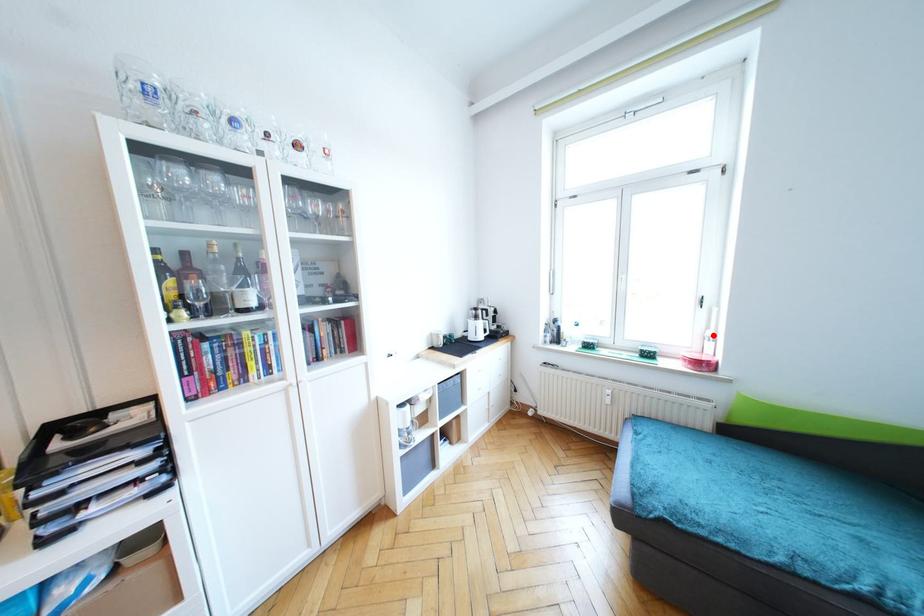
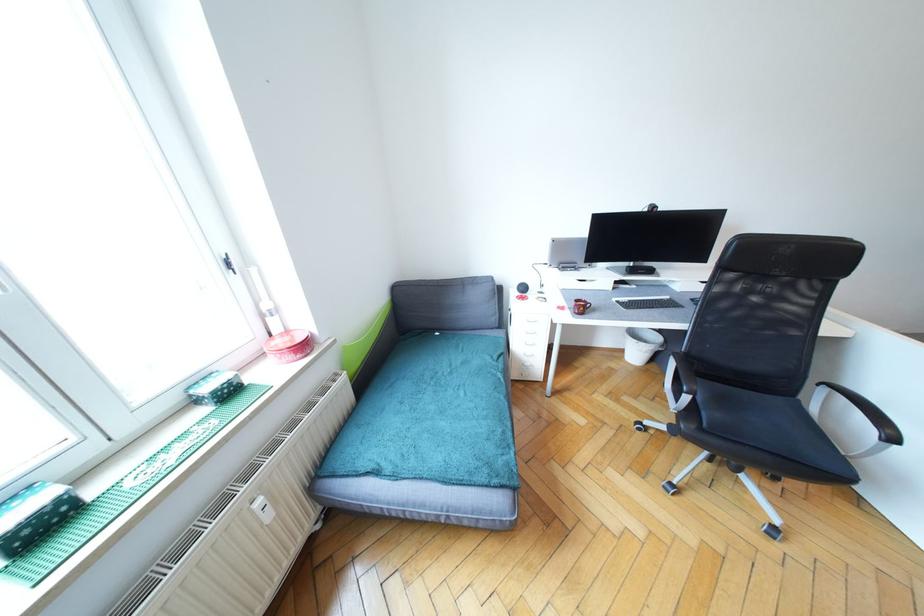
Locate, in the second image, the point that corresponds to the highlighted location in the first image.

(270, 307)